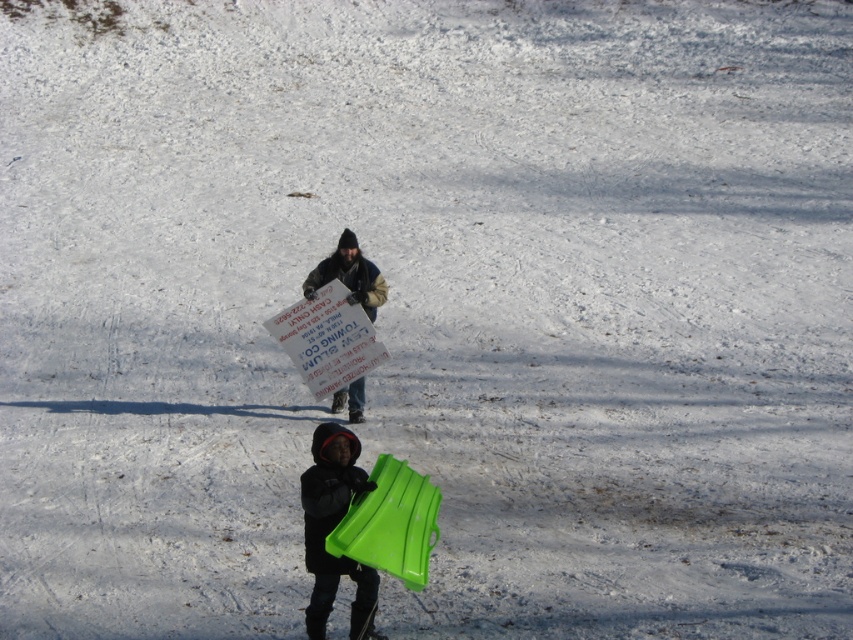
You are planning to set up a small snowman next to the sled. Given the positions of the matte green sled at lower center and the matte cardboard sign at center, where should you place the snowman so it doesn not block the sign?

You should place the snowman next to the matte green sled at lower center since it is located below the matte cardboard sign at center, so placing it there would keep it out of the sign s line of sight.

You are standing at the edge of a snowy hill and see the matte green sled at lower center and the matte cardboard sign at center. Which object would you need to walk towards first to reach the one farther away?

The matte cardboard sign at center is farther away than the matte green sled at lower center. Since you want to reach the one farther away first, you should walk towards the matte green sled at lower center first because it is closer, allowing you to then proceed to the farther sign.

In the scene shown: You are standing at the center of the snowy field and want to locate the matte green sled at lower center. According to the coordinates provided, in which direction should you move to reach it?

The matte green sled at lower center is located at coordinates point (332, 529). Since the coordinate system is not specified, but assuming standard image coordinates where x increases to the right and y increases downward, you should move towards the lower right direction to reach it.